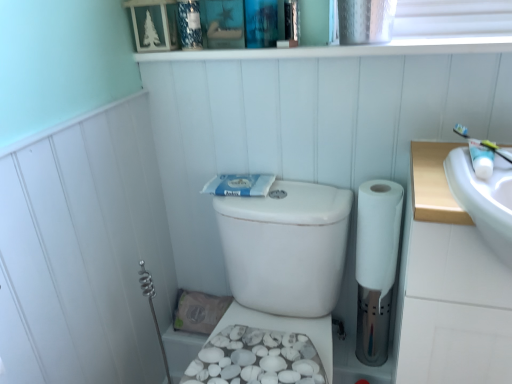
Identify the location of vacant area that lies to the right of blue matte toothpaste at center. The image size is (512, 384). (294, 183).